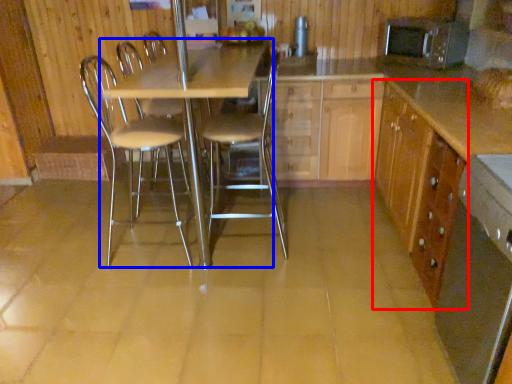
Question: Which object is further to the camera taking this photo, cabinetry (highlighted by a red box) or table (highlighted by a blue box)?

Choices:
 (A) cabinetry
 (B) table

Answer: (B)